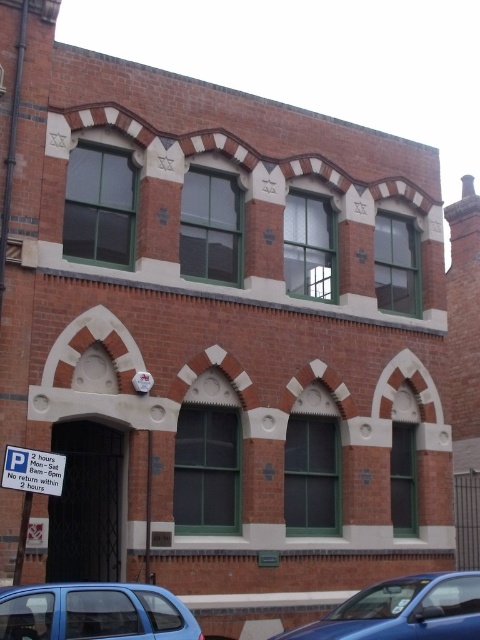
Question: Among these objects, which one is farthest from the camera?

Choices:
 (A) blue metallic hatchback at lower left
 (B) metallic rectangular sign at lower left

Answer: (B)

Question: Where is blue metallic hatchback at lower left located in relation to metallic rectangular sign at lower left in the image?

Choices:
 (A) above
 (B) below

Answer: (B)

Question: Which point appears farthest from the camera in this image?

Choices:
 (A) (27, 490)
 (B) (38, 616)
 (C) (478, 620)

Answer: (C)

Question: Is blue glossy car at lower right to the right of metallic rectangular sign at lower left from the viewer's perspective?

Choices:
 (A) no
 (B) yes

Answer: (B)

Question: Does blue metallic hatchback at lower left appear on the left side of metallic rectangular sign at lower left?

Choices:
 (A) yes
 (B) no

Answer: (B)

Question: Which of the following is the farthest from the observer?

Choices:
 (A) (59, 488)
 (B) (363, 628)
 (C) (95, 609)

Answer: (A)